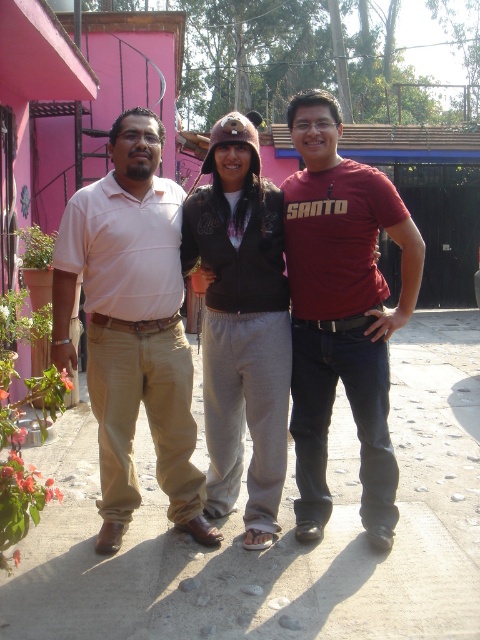
Question: Observing the image, what is the correct spatial positioning of maroon cotton shirt at center in reference to matte brown jacket at center?

Choices:
 (A) left
 (B) right

Answer: (B)

Question: Can you confirm if matte brown jacket at center is positioned below dark brown leather jacket at center?

Choices:
 (A) no
 (B) yes

Answer: (A)

Question: Estimate the real-world distances between objects in this image. Which object is closer to the matte brown jacket at center?

Choices:
 (A) light brown cotton pants at left
 (B) maroon cotton shirt at center

Answer: (B)

Question: Considering the real-world distances, which object is farthest from the dark brown leather jacket at center?

Choices:
 (A) light brown cotton pants at left
 (B) maroon cotton shirt at center

Answer: (A)

Question: Which object appears closest to the camera in this image?

Choices:
 (A) matte brown jacket at center
 (B) maroon cotton shirt at center
 (C) dark brown leather jacket at center
 (D) light brown cotton pants at left

Answer: (D)

Question: Is maroon cotton shirt at center behind dark brown leather jacket at center?

Choices:
 (A) yes
 (B) no

Answer: (B)